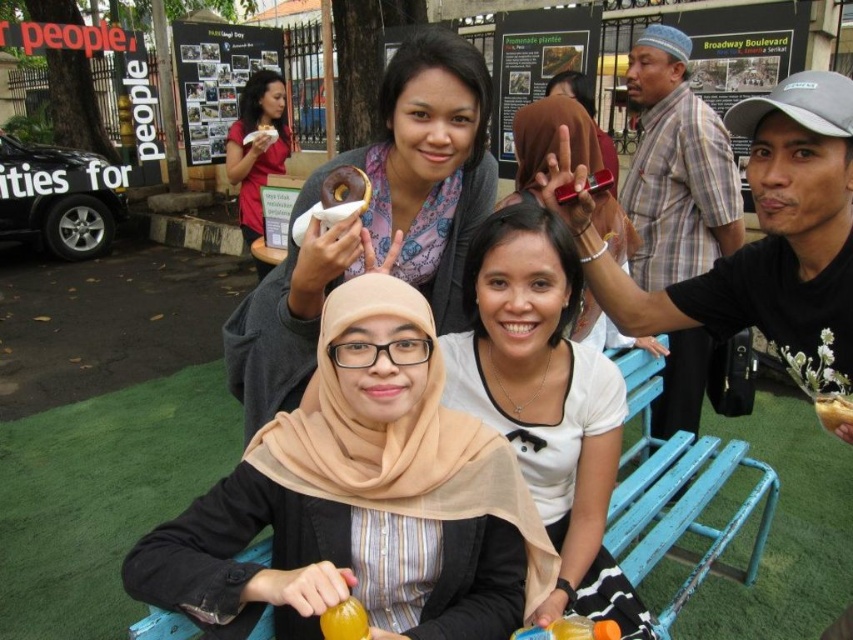
What are the coordinates of the brown glazed donut at center in the image?

The coordinates of the brown glazed donut at center are at point (345, 188).

You are a photographer trying to capture both the matte brown donut at upper center and the matte pink donut at upper left in a single photo. Which donut should you focus on first to ensure both are in the frame?

You should focus on the matte brown donut at upper center first because it is in front of the matte pink donut at upper left, so adjusting the camera to include the front one will likely also capture the one behind it.

You are at a bakery counter and see both the brown glazed donut at center and the yellow matte donut at center. Which donut is closer to you?

The brown glazed donut at center is closer to you because the yellow matte donut at center is behind it.